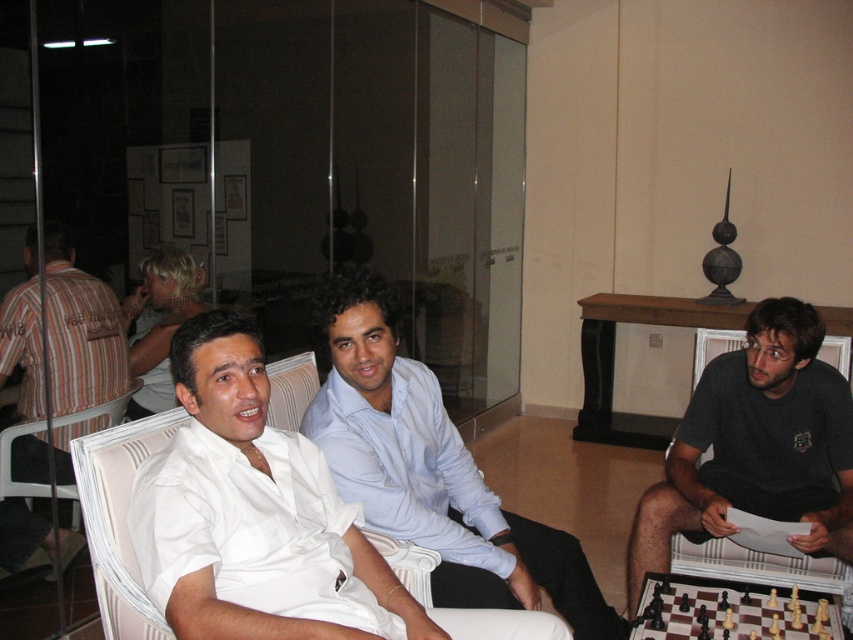
You are a photographer positioned at the entrance of the room. You need to take a photo that includes both the light blue shirt at center and the wooden chess set at lower right. Based on their positions, which object should be placed closer to the left side of the photo?

The light blue shirt at center should be placed closer to the left side of the photo because it is positioned to the left of the wooden chess set at lower right.

You are a photographer setting up a shoot in this room. You need to position a light source to the right of both the striped cotton shirt at left and the white fabric armchair at left. Is this possible given their positions?

The striped cotton shirt at left is to the left of white fabric armchair at left, so positioning a light source to the right of both is possible as they are aligned horizontally.